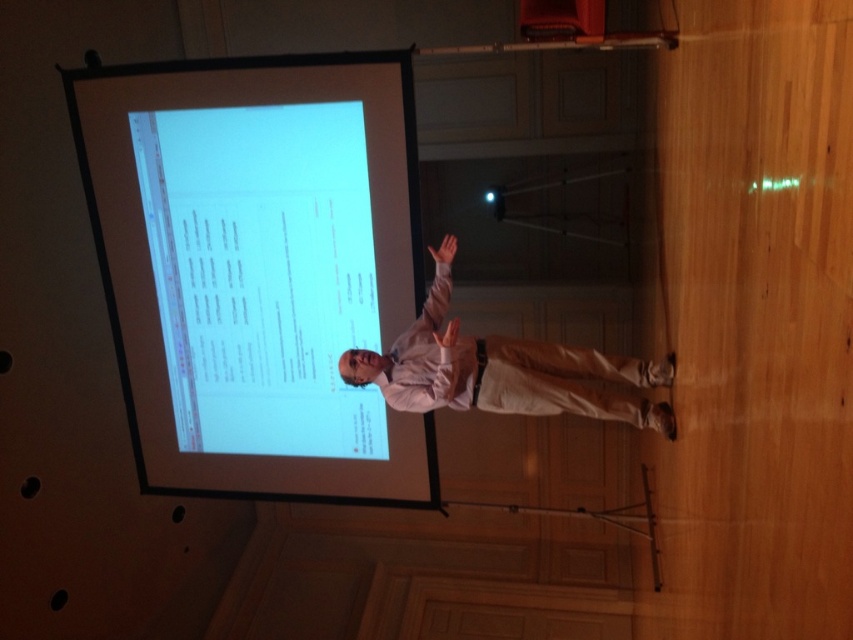
Question: Which point appears farthest from the camera in this image?

Choices:
 (A) (184, 168)
 (B) (508, 376)

Answer: (A)

Question: Which point appears closest to the camera in this image?

Choices:
 (A) (218, 356)
 (B) (512, 412)

Answer: (B)

Question: Can you confirm if white glossy projection screen at upper center is bigger than light brown cotton shirt at center?

Choices:
 (A) no
 (B) yes

Answer: (B)

Question: Does white glossy projection screen at upper center appear over light brown cotton shirt at center?

Choices:
 (A) yes
 (B) no

Answer: (A)

Question: Is white glossy projection screen at upper center wider than light brown cotton shirt at center?

Choices:
 (A) no
 (B) yes

Answer: (B)